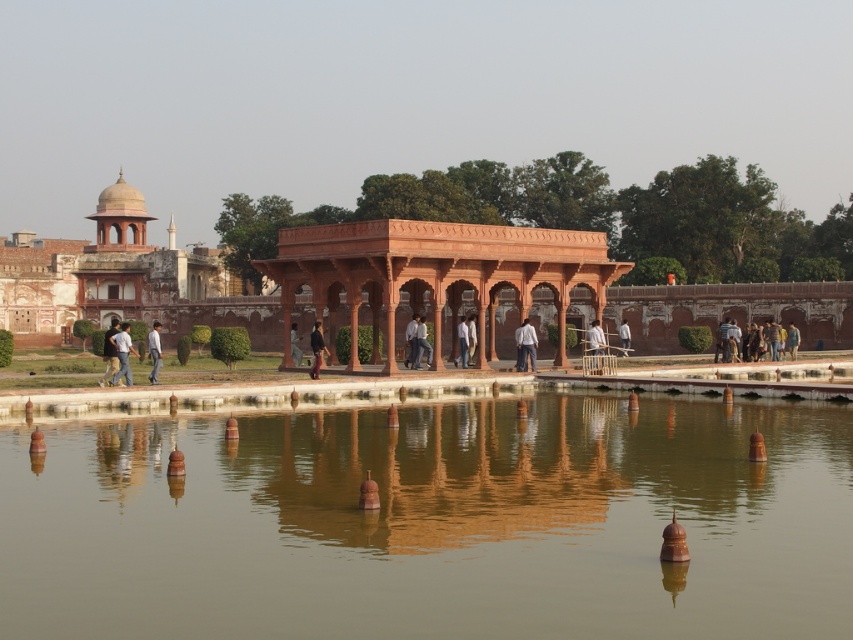
Question: Is light blue shirt at center to the left of black matte jacket at center from the viewer's perspective?

Choices:
 (A) no
 (B) yes

Answer: (A)

Question: Can you confirm if matte orange stone palace at upper left is positioned to the right of dark brown wooden pole at center?

Choices:
 (A) no
 (B) yes

Answer: (A)

Question: Which of the following is the closest to the observer?

Choices:
 (A) light brown leather jacket at center
 (B) dark blue jeans at left

Answer: (B)

Question: Which point appears closest to the camera in this image?

Choices:
 (A) (519, 339)
 (B) (102, 346)
 (C) (418, 364)

Answer: (A)

Question: Can you confirm if light brown wooden bench at right is positioned below dark blue jeans at center?

Choices:
 (A) no
 (B) yes

Answer: (A)

Question: Which point appears farthest from the camera in this image?

Choices:
 (A) (297, 339)
 (B) (775, 356)

Answer: (A)